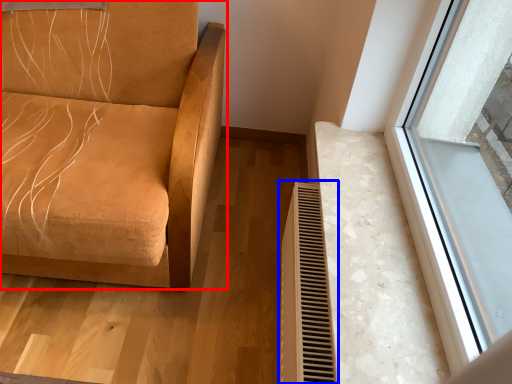
Question: Which point is closer to the camera, furniture (highlighted by a red box) or radiator (highlighted by a blue box)?

Choices:
 (A) furniture
 (B) radiator

Answer: (A)